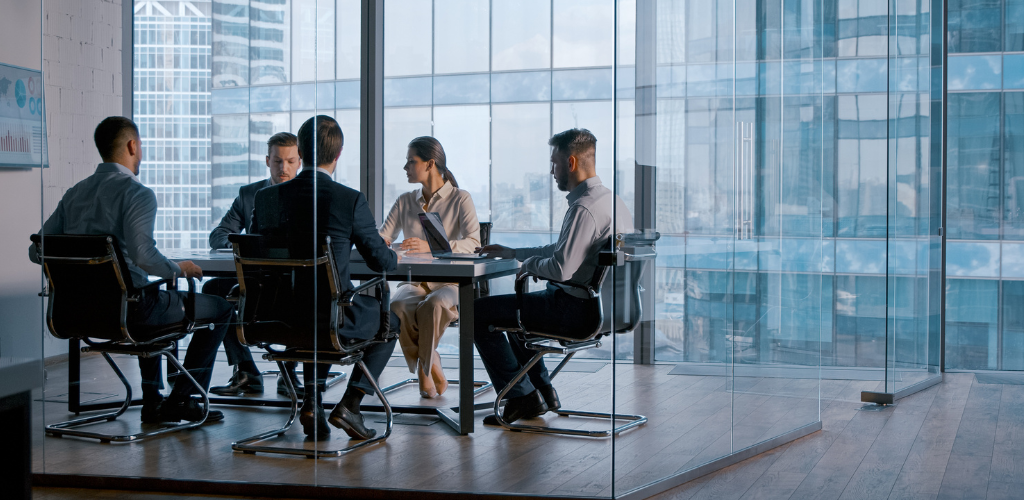
Locate an element on the screen. chairs is located at coordinates (108, 304), (264, 295), (613, 303), (483, 233).